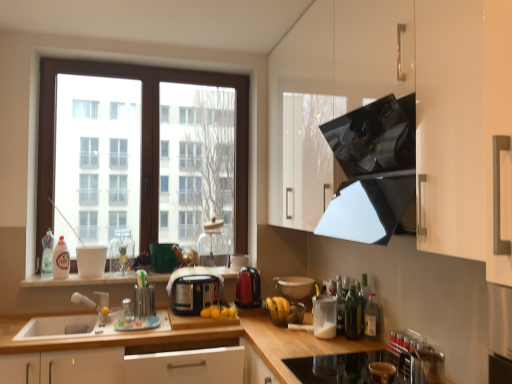
Question: Which direction should I rotate to look at red glossy electric kettle at center, arranged as the 1th kitchen appliance when viewed from the back?

Choices:
 (A) right
 (B) left

Answer: (B)

Question: Is white matte container at center, arranged as the second kitchen appliance when viewed from the back, further to camera compared to transparent glass jar at center, which is counted as the 2th appliance, starting from the back?

Choices:
 (A) no
 (B) yes

Answer: (A)

Question: Is white matte container at center, the second kitchen appliance in the left-to-right sequence, next to transparent glass jar at center, which is counted as the 2th appliance, starting from the back, and touching it?

Choices:
 (A) no
 (B) yes

Answer: (A)

Question: Considering the relative sizes of white matte container at center, the 1th kitchen appliance positioned from the right, and transparent glass jar at center, which is counted as the 2th appliance, starting from the back, in the image provided, is white matte container at center, the 1th kitchen appliance positioned from the right, wider than transparent glass jar at center, which is counted as the 2th appliance, starting from the back,?

Choices:
 (A) yes
 (B) no

Answer: (B)

Question: Is white matte container at center, placed as the first kitchen appliance when sorted from front to back, positioned far away from transparent glass jar at center, the seventh appliance when ordered from front to back?

Choices:
 (A) yes
 (B) no

Answer: (A)

Question: Can you confirm if white matte container at center, the 1th kitchen appliance positioned from the right, is positioned to the right of transparent glass jar at center, the seventh appliance when ordered from front to back?

Choices:
 (A) yes
 (B) no

Answer: (A)

Question: From a real-world perspective, is white matte container at center, arranged as the second kitchen appliance when viewed from the back, under transparent glass jar at center, which is counted as the 2th appliance, starting from the back?

Choices:
 (A) no
 (B) yes

Answer: (B)

Question: Is matte black toaster at center, which appears as the 5th appliance when viewed from the back, surrounded by white matte container at center, the 1th kitchen appliance positioned from the right?

Choices:
 (A) yes
 (B) no

Answer: (B)

Question: Is white matte container at center, placed as the first kitchen appliance when sorted from front to back, thinner than matte black toaster at center, marked as the 4th appliance in a front-to-back arrangement?

Choices:
 (A) no
 (B) yes

Answer: (B)

Question: Would you say white matte container at center, the 1th kitchen appliance positioned from the right, is a long distance from matte black toaster at center, which appears as the 5th appliance when viewed from the back?

Choices:
 (A) yes
 (B) no

Answer: (B)

Question: From a real-world perspective, is white matte container at center, arranged as the second kitchen appliance when viewed from the back, positioned over matte black toaster at center, marked as the 4th appliance in a front-to-back arrangement, based on gravity?

Choices:
 (A) yes
 (B) no

Answer: (B)

Question: Is white matte container at center, the second kitchen appliance in the left-to-right sequence, taller than matte black toaster at center, marked as the 4th appliance in a front-to-back arrangement?

Choices:
 (A) no
 (B) yes

Answer: (A)

Question: Does white matte container at center, arranged as the second kitchen appliance when viewed from the back, come behind matte black toaster at center, marked as the 4th appliance in a front-to-back arrangement?

Choices:
 (A) yes
 (B) no

Answer: (B)

Question: Is green glass bottle at lower right, which is the fourth bottle from left to right, further to the viewer compared to glossy black exhaust hood at upper right?

Choices:
 (A) no
 (B) yes

Answer: (B)